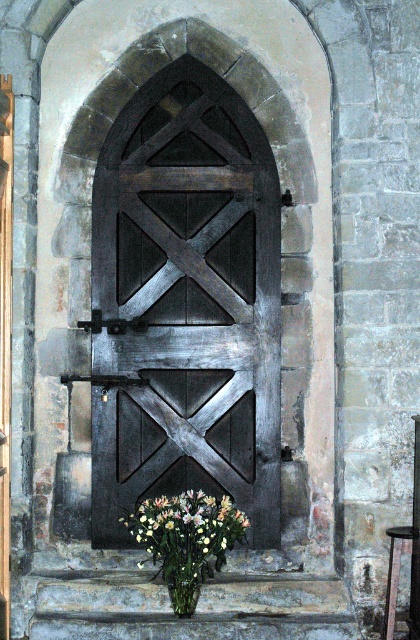
Between point (115, 280) and point (189, 582), which one is positioned in front?

Point (189, 582) is in front.

How far apart are dark wood barn door at center and green matte vase at lower center?

A distance of 34.82 inches exists between dark wood barn door at center and green matte vase at lower center.

This screenshot has height=640, width=420. In order to click on dark wood barn door at center in this screenshot , I will do `click(186, 304)`.

Is white matte vase at center below green matte vase at lower center?

No, white matte vase at center is not below green matte vase at lower center.

Can you confirm if white matte vase at center is bigger than green matte vase at lower center?

Yes.

This screenshot has width=420, height=640. What do you see at coordinates (186, 540) in the screenshot? I see `white matte vase at center` at bounding box center [186, 540].

Identify the location of white matte vase at center. (186, 540).

Is dark wood barn door at center to the right of white matte vase at center from the viewer's perspective?

In fact, dark wood barn door at center is to the left of white matte vase at center.

Does dark wood barn door at center appear over white matte vase at center?

Yes, dark wood barn door at center is above white matte vase at center.

Does point (168, 298) lie in front of point (215, 508)?

No.

Where is `dark wood barn door at center`? dark wood barn door at center is located at coordinates (186, 304).